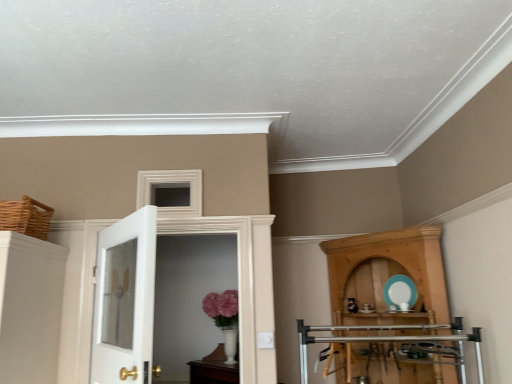
Question: Based on their sizes in the image, would you say woven brown basket at upper left is bigger or smaller than wooden cupboard at right?

Choices:
 (A) small
 (B) big

Answer: (A)

Question: From a real-world perspective, relative to wooden cupboard at right, is woven brown basket at upper left vertically above or below?

Choices:
 (A) above
 (B) below

Answer: (A)

Question: Which object is the closest to the woven brown basket at upper left?

Choices:
 (A) white glossy door at center, acting as the 1th door starting from the back
 (B) wooden cupboard at right
 (C) white glass door at left, the 1th door from the front

Answer: (C)

Question: Estimate the real-world distances between objects in this image. Which object is closer to the woven brown basket at upper left?

Choices:
 (A) white glossy door at center, acting as the 1th door starting from the back
 (B) white glass door at left, the 1th door from the front
 (C) wooden cupboard at right

Answer: (B)